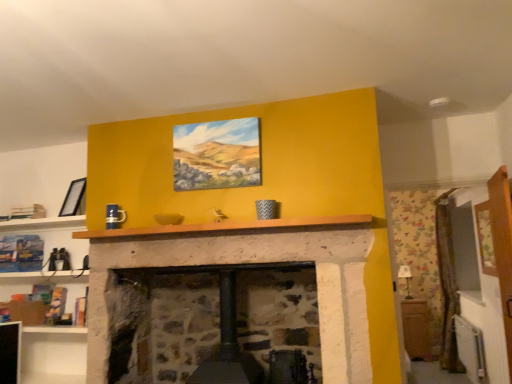
Question: Does wooden cabinet at right have a larger size compared to wooden mantle at center?

Choices:
 (A) yes
 (B) no

Answer: (A)

Question: Could you tell me if wooden cabinet at right is turned towards wooden mantle at center?

Choices:
 (A) yes
 (B) no

Answer: (B)

Question: Does wooden cabinet at right come behind wooden mantle at center?

Choices:
 (A) no
 (B) yes

Answer: (B)

Question: Considering the relative positions of wooden cabinet at right and wooden mantle at center in the image provided, is wooden cabinet at right to the right of wooden mantle at center from the viewer's perspective?

Choices:
 (A) no
 (B) yes

Answer: (B)

Question: Can you confirm if wooden cabinet at right is shorter than wooden mantle at center?

Choices:
 (A) no
 (B) yes

Answer: (A)

Question: Can you confirm if wooden cabinet at right is smaller than wooden mantle at center?

Choices:
 (A) no
 (B) yes

Answer: (A)

Question: Does matte canvas painting at center, arranged as the second picture frame when viewed from the left, have a lesser height compared to matte black picture frame at upper left, acting as the second picture frame starting from the right?

Choices:
 (A) no
 (B) yes

Answer: (A)

Question: Is matte canvas painting at center, the first picture frame viewed from the right, placed right next to matte black picture frame at upper left, marked as the 1th picture frame in a left-to-right arrangement?

Choices:
 (A) no
 (B) yes

Answer: (A)

Question: From a real-world perspective, is matte canvas painting at center, the first picture frame in the front-to-back sequence, over matte black picture frame at upper left, acting as the second picture frame starting from the right?

Choices:
 (A) no
 (B) yes

Answer: (B)

Question: From the image's perspective, is matte canvas painting at center, the first picture frame in the front-to-back sequence, above matte black picture frame at upper left, the 2th picture frame in the front-to-back sequence?

Choices:
 (A) yes
 (B) no

Answer: (A)

Question: Is the depth of matte canvas painting at center, the first picture frame viewed from the right, greater than that of matte black picture frame at upper left, acting as the second picture frame starting from the right?

Choices:
 (A) yes
 (B) no

Answer: (B)

Question: Is matte black picture frame at upper left, marked as the 1th picture frame in a left-to-right arrangement, completely or partially inside matte canvas painting at center, the first picture frame in the front-to-back sequence?

Choices:
 (A) no
 (B) yes

Answer: (A)

Question: From a real-world perspective, is matte black picture frame at upper left, which is the 1th picture frame in back-to-front order, physically above wooden mantle at center?

Choices:
 (A) yes
 (B) no

Answer: (A)